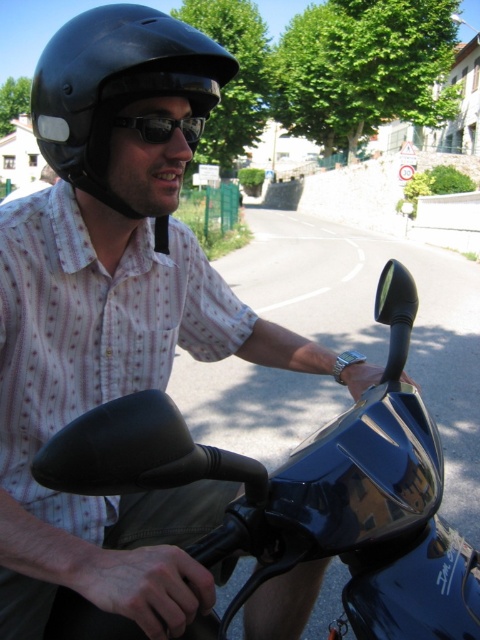
You are a fashion designer observing the rider. Which item of clothing or accessory is bigger in size between the white dotted shirt at center and the black reflective sunglasses at center?

The white dotted shirt at center is larger in size than the black reflective sunglasses at center.